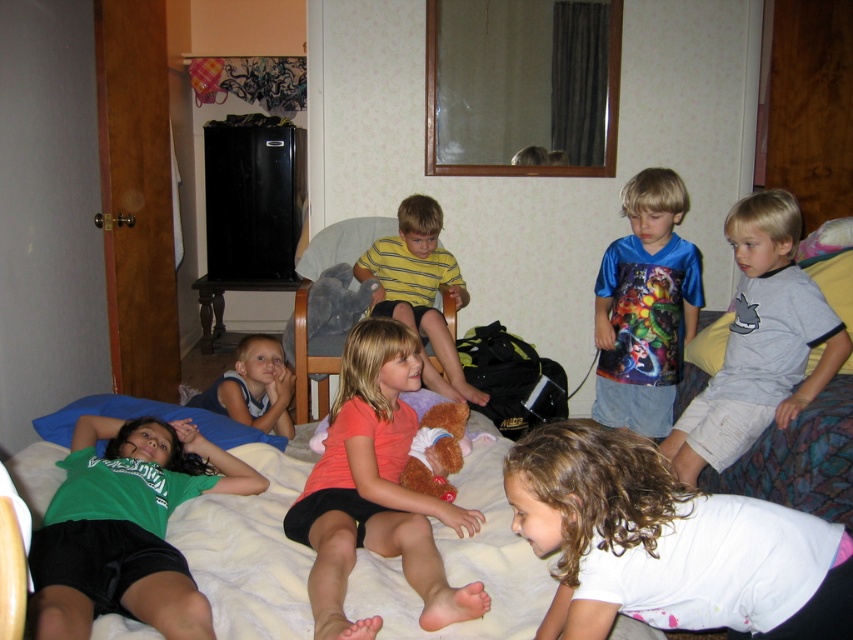
Question: Which point is farther from the camera taking this photo?

Choices:
 (A) (675, 296)
 (B) (281, 508)

Answer: (A)

Question: Which point is closer to the camera?

Choices:
 (A) (254, 420)
 (B) (622, 412)

Answer: (B)

Question: Which of the following is the farthest from the observer?

Choices:
 (A) blue shiny shirt at center
 (B) green matte shirt at lower left
 (C) white soft bed at lower center
 (D) blue fabric shirt at lower left

Answer: (D)

Question: Does green matte shirt at lower left have a lesser width compared to blue fabric shirt at lower left?

Choices:
 (A) no
 (B) yes

Answer: (A)

Question: Does white soft bed at lower center appear on the right side of orange matte shirt at center?

Choices:
 (A) yes
 (B) no

Answer: (B)

Question: Considering the relative positions of green matte shirt at lower left and gray cotton shirt at upper right in the image provided, where is green matte shirt at lower left located with respect to gray cotton shirt at upper right?

Choices:
 (A) left
 (B) right

Answer: (A)